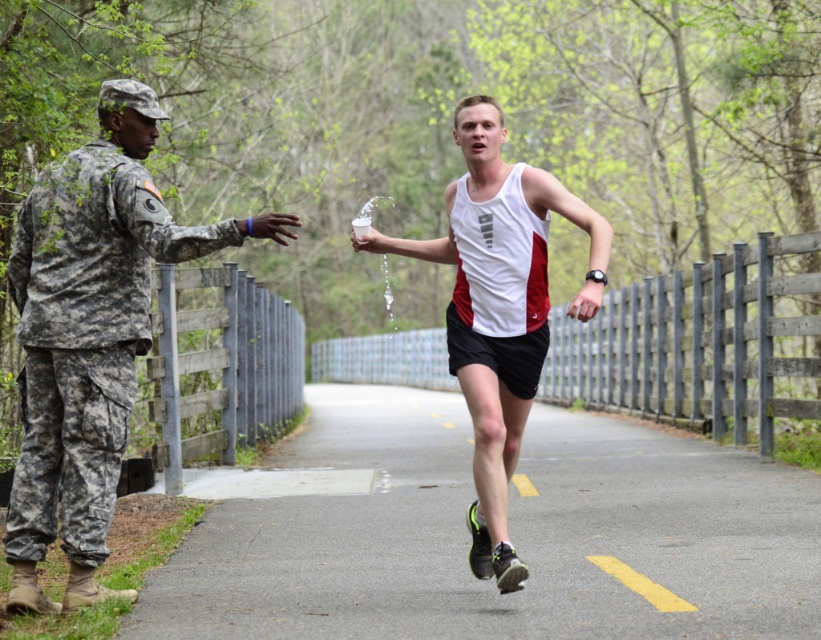
Looking at this image, you are a hiker trying to follow a guide on a narrow path. You see the camouflage uniform at left and the white matte tank top at center. Which direction should you walk to stay on the path?

The camouflage uniform at left is positioned under the white matte tank top at center, so you should walk towards the center where the white matte tank top at center is located to stay on the path.

You are a hiker who just arrived at the scene. You see a black rubber shoe at center and a white matte tank top at center. Which item is bigger in size?

The black rubber shoe at center has a larger size compared to the white matte tank top at center.